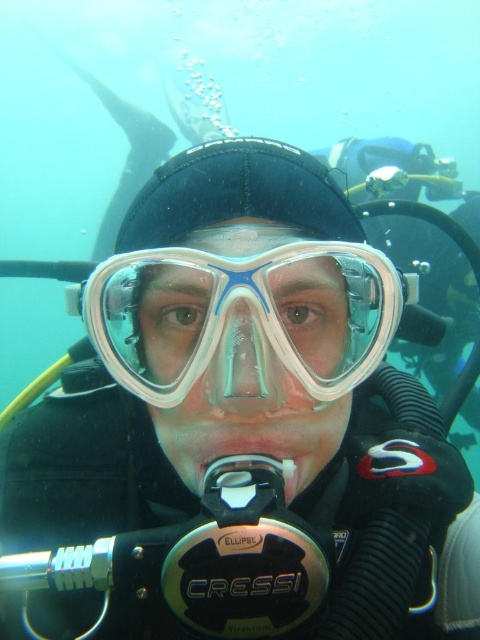
Question: Which point is farther to the camera?

Choices:
 (A) (225, 307)
 (B) (259, 448)

Answer: (B)

Question: Among these points, which one is farthest from the camera?

Choices:
 (A) (109, 292)
 (B) (218, 442)
 (C) (216, 403)

Answer: (A)

Question: Is transparent plastic goggles at center to the left of white plastic mouthpiece at center from the viewer's perspective?

Choices:
 (A) no
 (B) yes

Answer: (B)

Question: Considering the relative positions of transparent plastic goggles at center and white plastic mouthpiece at center in the image provided, where is transparent plastic goggles at center located with respect to white plastic mouthpiece at center?

Choices:
 (A) left
 (B) right

Answer: (A)

Question: Which object appears farthest from the camera in this image?

Choices:
 (A) transparent plastic goggles at center
 (B) transparent plastic nose at center
 (C) white plastic mouthpiece at center

Answer: (C)

Question: Does transparent plastic nose at center have a lesser width compared to white plastic mouthpiece at center?

Choices:
 (A) yes
 (B) no

Answer: (A)